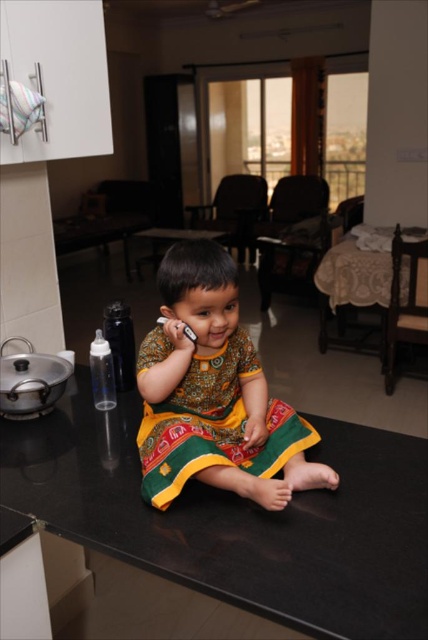
Can you confirm if black granite table at lower center is bigger than printed cotton dress at center?

Yes, black granite table at lower center is bigger than printed cotton dress at center.

From the picture: Who is positioned more to the left, black granite table at lower center or printed cotton dress at center?

From the viewer's perspective, black granite table at lower center appears more on the left side.

Does point (214, 566) come farther from viewer compared to point (246, 497)?

No, (214, 566) is in front of (246, 497).

Locate an element on the screen. black granite table at lower center is located at coordinates (241, 520).

Can you confirm if black granite table at lower center is bigger than wooden table at center?

No, black granite table at lower center is not bigger than wooden table at center.

Who is more forward, (205, 592) or (403, 273)?

Point (205, 592)

Image resolution: width=428 pixels, height=640 pixels. What are the coordinates of `black granite table at lower center` in the screenshot? It's located at (241, 520).

Between point (293, 456) and point (422, 252), which one is positioned in front?

Point (293, 456) is more forward.

Describe the element at coordinates (214, 394) in the screenshot. I see `printed cotton dress at center` at that location.

Does point (240, 481) lie in front of point (332, 259)?

Yes, point (240, 481) is in front of point (332, 259).

Where is `printed cotton dress at center`? printed cotton dress at center is located at coordinates (214, 394).